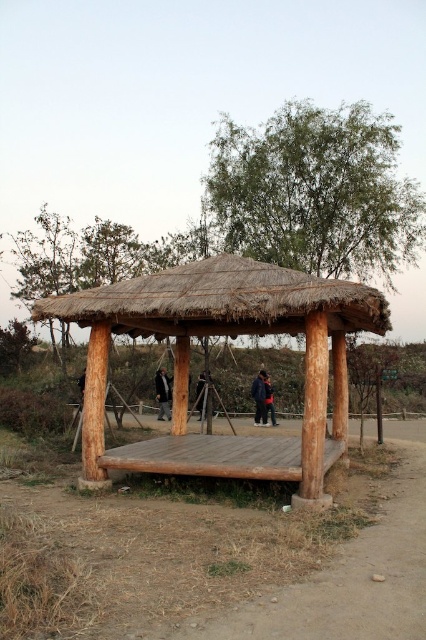
Question: Which object appears closest to the camera in this image?

Choices:
 (A) dark blue jacket at center
 (B) thatched straw roof at center
 (C) dark brown leather jacket at center

Answer: (B)

Question: Which point is farther to the camera?

Choices:
 (A) thatched straw roof at center
 (B) natural wood gazebo at center
 (C) brown dirt field at lower center
 (D) dark blue jeans at center

Answer: (D)

Question: Is natural wood gazebo at center smaller than dark brown leather jacket at center?

Choices:
 (A) yes
 (B) no

Answer: (A)

Question: Estimate the real-world distances between objects in this image. Which object is farther from the brown dirt field at lower center?

Choices:
 (A) dark blue jeans at center
 (B) natural wood gazebo at center
 (C) thatched straw roof at center
 (D) dark blue jacket at center

Answer: (D)

Question: Does thatched straw roof at center appear on the right side of dark brown leather jacket at center?

Choices:
 (A) yes
 (B) no

Answer: (A)

Question: Does dark brown leather jacket at center appear under dark blue jacket at center?

Choices:
 (A) yes
 (B) no

Answer: (B)